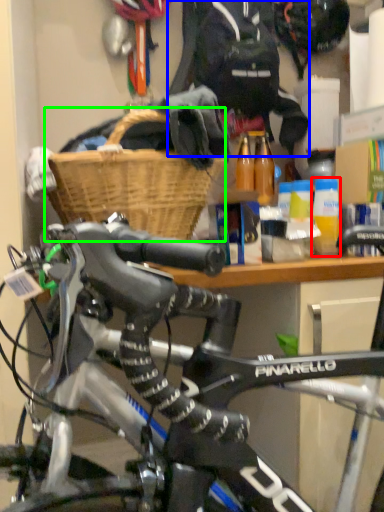
Question: Which object is positioned farthest from bottle (highlighted by a red box)? Select from clothing (highlighted by a blue box) and basket (highlighted by a green box).

Choices:
 (A) clothing
 (B) basket

Answer: (A)